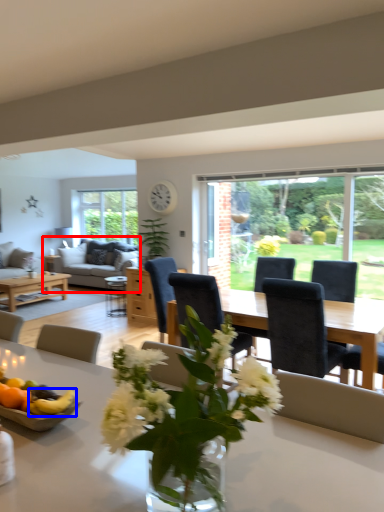
Question: Among these objects, which one is farthest to the camera, studio couch (highlighted by a red box) or fruit (highlighted by a blue box)?

Choices:
 (A) studio couch
 (B) fruit

Answer: (A)